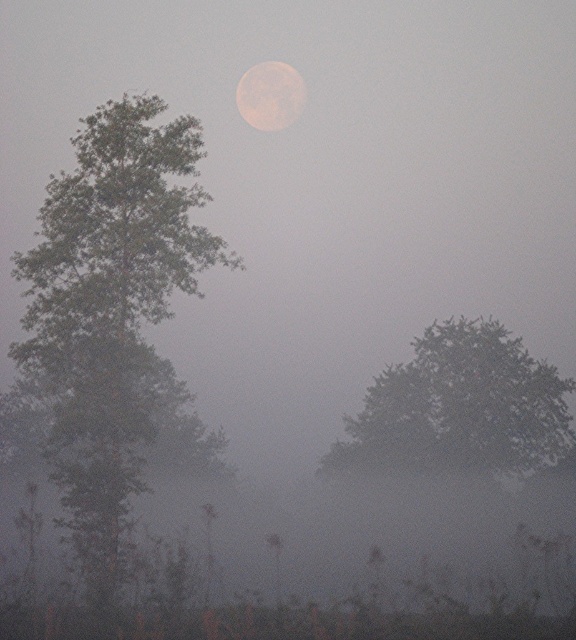
You are standing in the misty landscape and want to take a photo of the green leafy tree at left. Your camera has a minimum focus distance of 30 meters. Will the camera be able to focus on the tree?

The green leafy tree at left is 33.08 meters from camera, which is beyond the camera minimum focus distance of 30 meters. So the camera can focus on the tree.